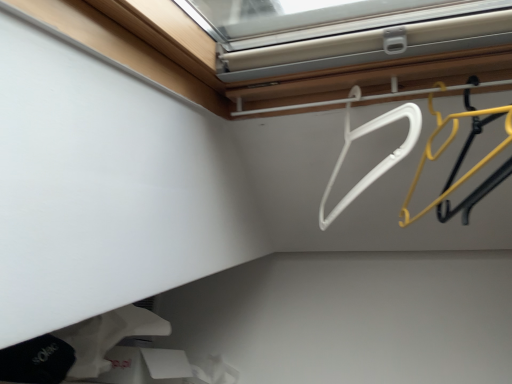
Question: Is white plastic hanger at upper center, the second hanger when ordered from right to left, oriented away from yellow plastic hanger at upper right, which is the 1th hanger in right-to-left order?

Choices:
 (A) no
 (B) yes

Answer: (A)

Question: From a real-world perspective, is white plastic hanger at upper center, the first hanger positioned from the left, located beneath yellow plastic hanger at upper right, which is the 1th hanger in right-to-left order?

Choices:
 (A) yes
 (B) no

Answer: (B)

Question: Considering the relative sizes of white plastic hanger at upper center, the second hanger when ordered from right to left, and yellow plastic hanger at upper right, the second hanger from the left, in the image provided, is white plastic hanger at upper center, the second hanger when ordered from right to left, wider than yellow plastic hanger at upper right, the second hanger from the left,?

Choices:
 (A) no
 (B) yes

Answer: (A)

Question: Considering the relative positions of white plastic hanger at upper center, the first hanger positioned from the left, and yellow plastic hanger at upper right, which is the 1th hanger in right-to-left order, in the image provided, is white plastic hanger at upper center, the first hanger positioned from the left, behind yellow plastic hanger at upper right, which is the 1th hanger in right-to-left order,?

Choices:
 (A) no
 (B) yes

Answer: (B)

Question: Does white plastic hanger at upper center, the first hanger positioned from the left, have a smaller size compared to yellow plastic hanger at upper right, the second hanger from the left?

Choices:
 (A) no
 (B) yes

Answer: (A)

Question: From a real-world perspective, relative to white plastic hanger at upper center, the first hanger positioned from the left, is white matte socks at lower left vertically above or below?

Choices:
 (A) below
 (B) above

Answer: (A)

Question: Visually, is white matte socks at lower left positioned to the left or to the right of white plastic hanger at upper center, the second hanger when ordered from right to left?

Choices:
 (A) left
 (B) right

Answer: (A)

Question: Is white matte socks at lower left in front of or behind white plastic hanger at upper center, the second hanger when ordered from right to left, in the image?

Choices:
 (A) behind
 (B) front

Answer: (A)

Question: Considering the positions of white matte socks at lower left and white plastic hanger at upper center, the second hanger when ordered from right to left, in the image, is white matte socks at lower left taller or shorter than white plastic hanger at upper center, the second hanger when ordered from right to left,?

Choices:
 (A) short
 (B) tall

Answer: (A)

Question: In terms of height, does white matte socks at lower left look taller or shorter compared to yellow plastic hanger at upper right, which is the 1th hanger in right-to-left order?

Choices:
 (A) short
 (B) tall

Answer: (B)

Question: Is white matte socks at lower left in front of or behind yellow plastic hanger at upper right, which is the 1th hanger in right-to-left order, in the image?

Choices:
 (A) front
 (B) behind

Answer: (B)

Question: Is point (68, 342) positioned closer to the camera than point (414, 216)?

Choices:
 (A) closer
 (B) farther

Answer: (A)

Question: From the image's perspective, is white matte socks at lower left above or below yellow plastic hanger at upper right, which is the 1th hanger in right-to-left order?

Choices:
 (A) below
 (B) above

Answer: (A)

Question: Considering the positions of white plastic hanger at upper center, the second hanger when ordered from right to left, and yellow plastic hanger at upper right, which is the 1th hanger in right-to-left order, in the image, is white plastic hanger at upper center, the second hanger when ordered from right to left, wider or thinner than yellow plastic hanger at upper right, which is the 1th hanger in right-to-left order,?

Choices:
 (A) thin
 (B) wide

Answer: (A)

Question: Considering the relative positions of white plastic hanger at upper center, the second hanger when ordered from right to left, and yellow plastic hanger at upper right, which is the 1th hanger in right-to-left order, in the image provided, is white plastic hanger at upper center, the second hanger when ordered from right to left, to the left or to the right of yellow plastic hanger at upper right, which is the 1th hanger in right-to-left order,?

Choices:
 (A) right
 (B) left

Answer: (B)